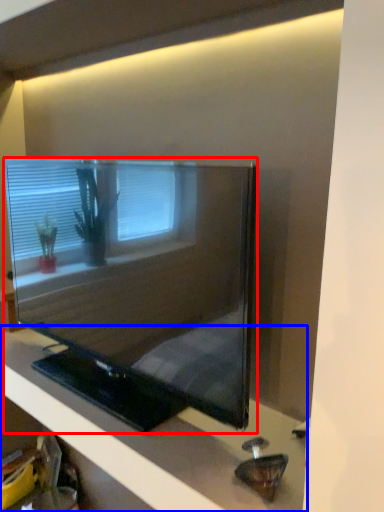
Question: Among these objects, which one is farthest to the camera, television (highlighted by a red box) or furniture (highlighted by a blue box)?

Choices:
 (A) television
 (B) furniture

Answer: (A)